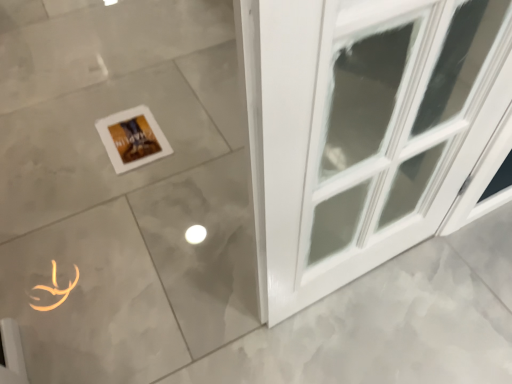
This screenshot has width=512, height=384. Find the location of `free space above white matte picture frame at center (from a real-world perspective)`. free space above white matte picture frame at center (from a real-world perspective) is located at coordinates click(x=130, y=133).